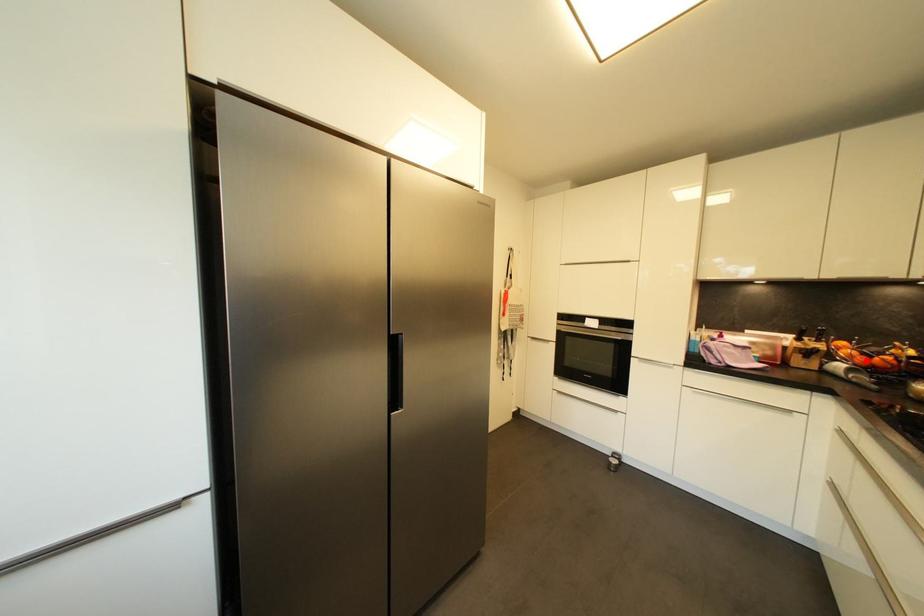
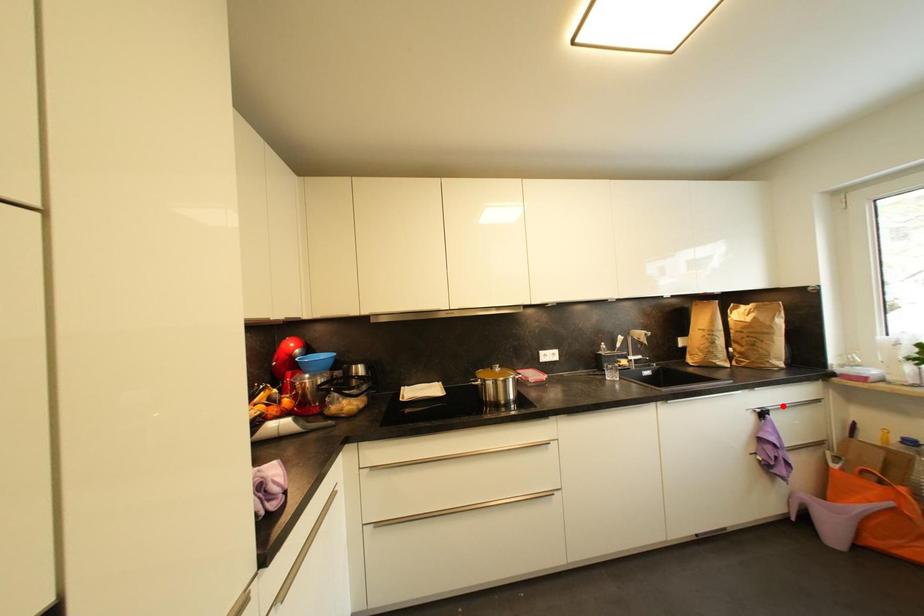
I am providing you with two images of the same scene from different viewpoints. A red point is marked on the first image and another point is marked on the second image. Are the points marked in image1 and image2 representing the same 3D position?

No